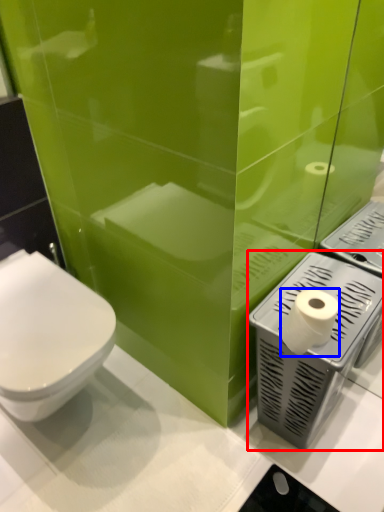
Question: Which point is closer to the camera, appliance (highlighted by a red box) or toilet paper (highlighted by a blue box)?

Choices:
 (A) appliance
 (B) toilet paper

Answer: (B)